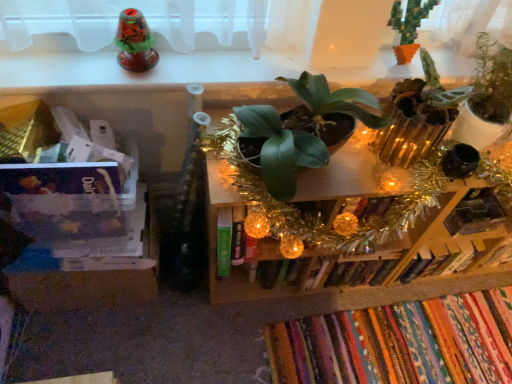
Find the location of a particular element. The width and height of the screenshot is (512, 384). empty space that is ontop of multicolored woven rug at lower right, placed as the 2th book when sorted from top to bottom is located at coordinates (393, 349).